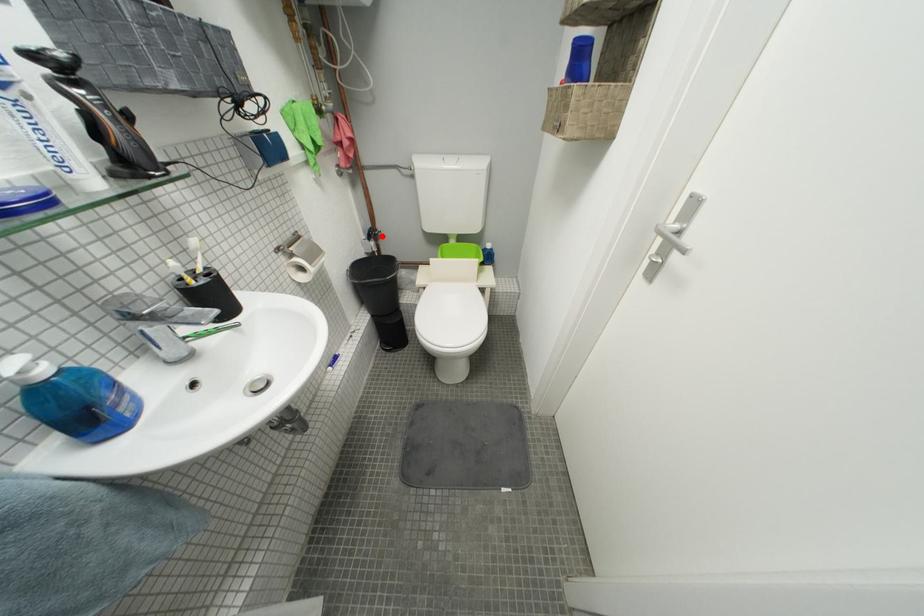
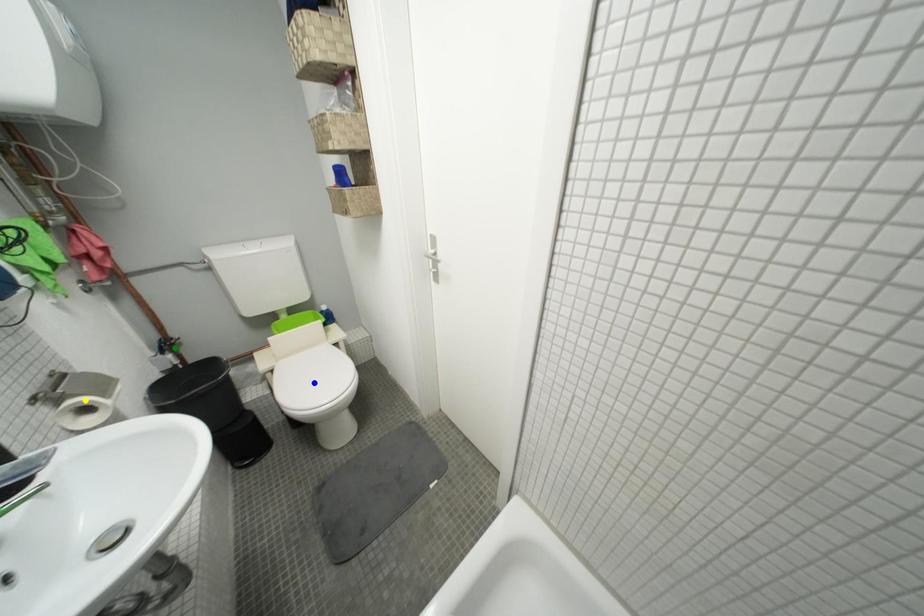
Question: I am providing you with two images of the same scene from different viewpoints. A red point is marked on the first image. You are given multiple points on the second image. Which point in image 2 is actually the same real-world point as the red point in image 1?

Choices:
 (A) green point
 (B) blue point
 (C) yellow point

Answer: (A)